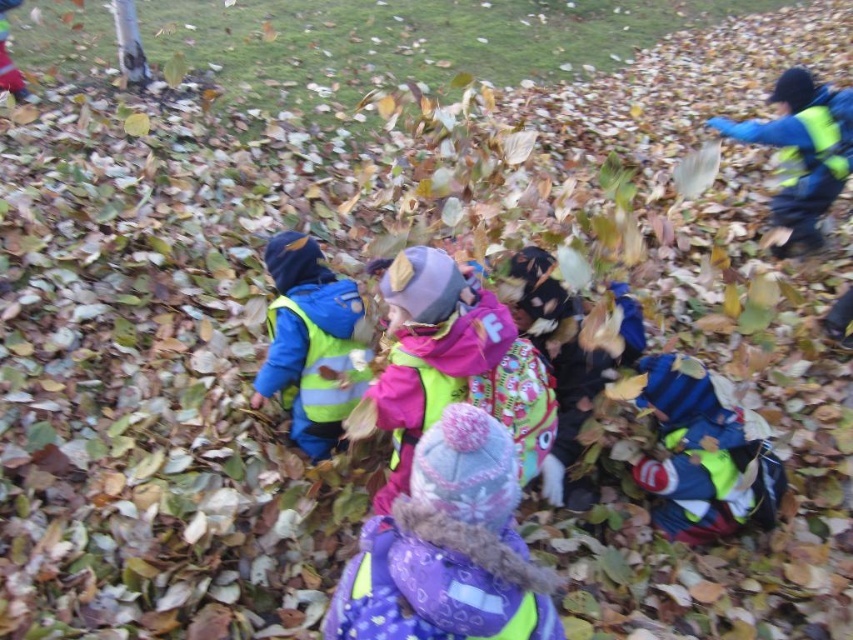
Can you confirm if vibrant pink fleece at center is smaller than reflective yellow vest at center?

No, vibrant pink fleece at center is not smaller than reflective yellow vest at center.

Does vibrant pink fleece at center appear on the left side of reflective yellow vest at center?

In fact, vibrant pink fleece at center is to the right of reflective yellow vest at center.

Between point (460, 269) and point (285, 358), which one is positioned behind?

Point (285, 358)

I want to click on vibrant pink fleece at center, so click(453, 364).